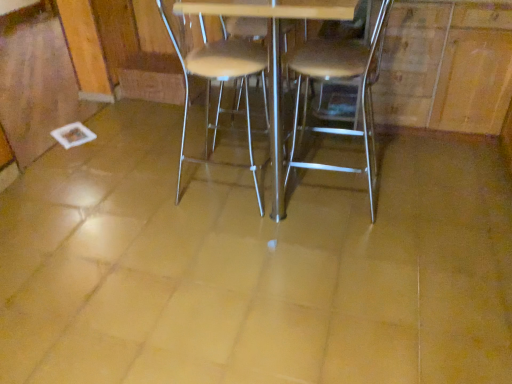
This screenshot has width=512, height=384. What do you see at coordinates (341, 78) in the screenshot? I see `metallic silver chair at center, the first chair positioned from the right` at bounding box center [341, 78].

What do you see at coordinates (273, 54) in the screenshot? The image size is (512, 384). I see `metallic silver table at center` at bounding box center [273, 54].

You are a GUI agent. You are given a task and a screenshot of the screen. Output one action in this format:
    pyautogui.click(x=<x>, y=<y>)
    Task: Click on the metallic silver chair at center, which appears as the 2th chair when viewed from the left
    This screenshot has width=512, height=384.
    Given the screenshot: What is the action you would take?
    pyautogui.click(x=341, y=78)

Looking at their sizes, would you say metallic silver chair at center, the first chair positioned from the right, is wider or thinner than metallic silver chair at center, arranged as the second chair when viewed from the right?

In the image, metallic silver chair at center, the first chair positioned from the right, appears to be wider than metallic silver chair at center, arranged as the second chair when viewed from the right.

Is metallic silver chair at center, which appears as the 2th chair when viewed from the left, placed right next to metallic silver chair at center, which appears as the first chair when viewed from the left?

No, metallic silver chair at center, which appears as the 2th chair when viewed from the left, is not next to metallic silver chair at center, which appears as the first chair when viewed from the left.

Is metallic silver chair at center, the first chair positioned from the right, to the left of metallic silver chair at center, which appears as the first chair when viewed from the left, from the viewer's perspective?

No, metallic silver chair at center, the first chair positioned from the right, is not to the left of metallic silver chair at center, which appears as the first chair when viewed from the left.

Measure the distance from metallic silver chair at center, which appears as the 2th chair when viewed from the left, to metallic silver chair at center, which appears as the first chair when viewed from the left.

metallic silver chair at center, which appears as the 2th chair when viewed from the left, is 21.93 inches from metallic silver chair at center, which appears as the first chair when viewed from the left.

From a real-world perspective, which object stands above the other?

metallic silver table at center, from a real-world perspective.

Between point (212, 12) and point (180, 170), which one is positioned behind?

The point (180, 170) is farther.

Considering the positions of objects metallic silver table at center and metallic silver chair at center, which appears as the first chair when viewed from the left, in the image provided, who is more to the left, metallic silver table at center or metallic silver chair at center, which appears as the first chair when viewed from the left,?

From the viewer's perspective, metallic silver chair at center, which appears as the first chair when viewed from the left, appears more on the left side.

Can you confirm if metallic silver table at center is smaller than metallic silver chair at center, which appears as the first chair when viewed from the left?

No.

Is metallic silver chair at center, which appears as the 2th chair when viewed from the left, completely or partially inside metallic silver table at center?

Indeed, metallic silver chair at center, which appears as the 2th chair when viewed from the left, is located within metallic silver table at center.

Is metallic silver table at center positioned before metallic silver chair at center, which appears as the 2th chair when viewed from the left?

That is True.

Considering the sizes of objects metallic silver table at center and metallic silver chair at center, which appears as the 2th chair when viewed from the left, in the image provided, who is smaller, metallic silver table at center or metallic silver chair at center, which appears as the 2th chair when viewed from the left,?

Smaller between the two is metallic silver chair at center, which appears as the 2th chair when viewed from the left.

Considering the relative sizes of metallic silver chair at center, arranged as the second chair when viewed from the right, and metallic silver table at center in the image provided, is metallic silver chair at center, arranged as the second chair when viewed from the right, smaller than metallic silver table at center?

Indeed, metallic silver chair at center, arranged as the second chair when viewed from the right, has a smaller size compared to metallic silver table at center.

Which object is wider, metallic silver chair at center, which appears as the first chair when viewed from the left, or metallic silver table at center?

With larger width is metallic silver table at center.

How different are the orientations of metallic silver chair at center, which appears as the first chair when viewed from the left, and metallic silver table at center in degrees?

92.4 degrees separate the facing orientations of metallic silver chair at center, which appears as the first chair when viewed from the left, and metallic silver table at center.

Measure the distance between metallic silver chair at center, which appears as the first chair when viewed from the left, and metallic silver table at center.

They are 29.22 inches apart.

Is metallic silver chair at center, which appears as the first chair when viewed from the left, next to metallic silver chair at center, the first chair positioned from the right?

No, metallic silver chair at center, which appears as the first chair when viewed from the left, is not in contact with metallic silver chair at center, the first chair positioned from the right.

Consider the image. From the image's perspective, is metallic silver chair at center, which appears as the first chair when viewed from the left, above metallic silver chair at center, which appears as the 2th chair when viewed from the left?

Correct, metallic silver chair at center, which appears as the first chair when viewed from the left, appears higher than metallic silver chair at center, which appears as the 2th chair when viewed from the left, in the image.

Is point (267, 106) closer or farther from the camera than point (370, 116)?

Point (267, 106).

What's the angular difference between metallic silver chair at center, arranged as the second chair when viewed from the right, and metallic silver chair at center, which appears as the 2th chair when viewed from the left,'s facing directions?

The angular difference between metallic silver chair at center, arranged as the second chair when viewed from the right, and metallic silver chair at center, which appears as the 2th chair when viewed from the left, is 179 degrees.

What's the angular difference between metallic silver chair at center, the first chair positioned from the right, and metallic silver table at center's facing directions?

metallic silver chair at center, the first chair positioned from the right, and metallic silver table at center are facing 88.4 degrees away from each other.

Which object is positioned more to the right, metallic silver chair at center, the first chair positioned from the right, or metallic silver table at center?

Positioned to the right is metallic silver chair at center, the first chair positioned from the right.

Does metallic silver chair at center, the first chair positioned from the right, lie behind metallic silver table at center?

That is True.

Considering the positions of point (373, 177) and point (222, 3), is point (373, 177) closer or farther from the camera than point (222, 3)?

Point (373, 177) is positioned farther from the camera compared to point (222, 3).

You are a GUI agent. You are given a task and a screenshot of the screen. Output one action in this format:
    pyautogui.click(x=<x>, y=<y>)
    Task: Click on the chair located behind the metallic silver chair at center, the first chair positioned from the right
    This screenshot has height=384, width=512.
    Given the screenshot: What is the action you would take?
    pyautogui.click(x=225, y=80)

Locate an element on the screen. round table located above the metallic silver chair at center, arranged as the second chair when viewed from the right (from a real-world perspective) is located at coordinates (273, 54).

From the image, which object appears to be nearer to metallic silver chair at center, arranged as the second chair when viewed from the right, metallic silver table at center or metallic silver chair at center, the first chair positioned from the right?

metallic silver chair at center, the first chair positioned from the right.

Consider the image. Which object lies further to the anchor point metallic silver table at center, metallic silver chair at center, arranged as the second chair when viewed from the right, or metallic silver chair at center, which appears as the 2th chair when viewed from the left?

metallic silver chair at center, arranged as the second chair when viewed from the right.

Considering their positions, is metallic silver chair at center, which appears as the 2th chair when viewed from the left, positioned further to metallic silver table at center than metallic silver chair at center, which appears as the first chair when viewed from the left?

metallic silver chair at center, which appears as the first chair when viewed from the left, is positioned further to the anchor metallic silver table at center.

From the image, which object appears to be farther from metallic silver chair at center, which appears as the 2th chair when viewed from the left, metallic silver chair at center, arranged as the second chair when viewed from the right, or metallic silver table at center?

Among the two, metallic silver table at center is located further to metallic silver chair at center, which appears as the 2th chair when viewed from the left.

Based on their spatial positions, is metallic silver chair at center, the first chair positioned from the right, or metallic silver table at center closer to metallic silver chair at center, which appears as the first chair when viewed from the left?

Based on the image, metallic silver chair at center, the first chair positioned from the right, appears to be nearer to metallic silver chair at center, which appears as the first chair when viewed from the left.

Consider the image. Estimate the real-world distances between objects in this image. Which object is further from metallic silver chair at center, which appears as the 2th chair when viewed from the left, metallic silver table at center or metallic silver chair at center, arranged as the second chair when viewed from the right?

The object further to metallic silver chair at center, which appears as the 2th chair when viewed from the left, is metallic silver table at center.

This screenshot has width=512, height=384. What are the coordinates of `round table between metallic silver chair at center, which appears as the first chair when viewed from the left, and metallic silver chair at center, which appears as the 2th chair when viewed from the left, from left to right` in the screenshot? It's located at (273, 54).